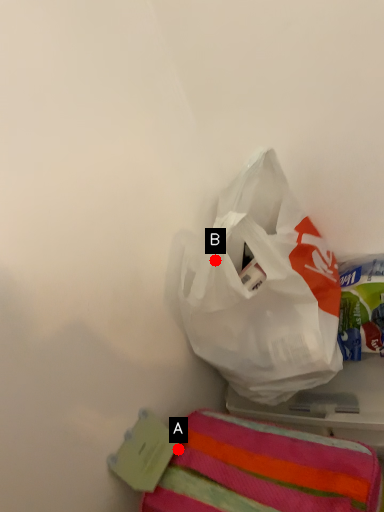
Question: Two points are circled on the image, labeled by A and B beside each circle. Which point is further to the camera?

Choices:
 (A) A is further
 (B) B is further

Answer: (A)